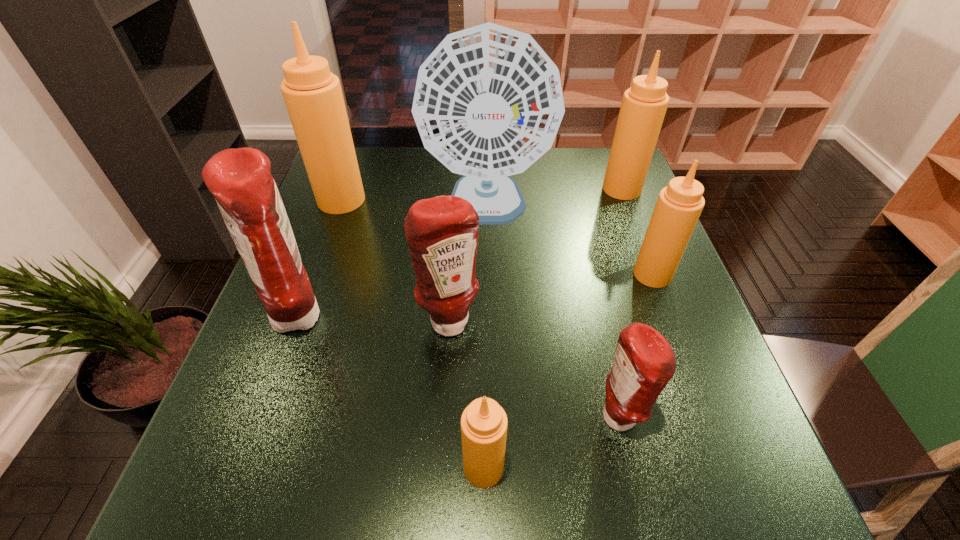
Locate an element on the screen. The width and height of the screenshot is (960, 540). empty location between the second biggest tan condiment and the second red condiment from right to left is located at coordinates (536, 255).

I want to click on vacant area that lies between the second red condiment from right to left and the fourth farthest object, so click(x=551, y=298).

I want to click on unoccupied area between the leftmost tan condiment and the biggest red condiment, so click(321, 258).

Identify the location of free space that is in between the biggest red condiment and the third condiment from right to left. This screenshot has height=540, width=960. (459, 367).

At what (x,y) coordinates should I click in order to perform the action: click on vacant area between the second red condiment from right to left and the leftmost red condiment. Please return your answer as a coordinate pair (x, y). The width and height of the screenshot is (960, 540). Looking at the image, I should click on (374, 319).

Identify the location of free spot between the biggest red condiment and the second nearest condiment. This screenshot has height=540, width=960. (459, 367).

Where is `vacant space that is in between the biggest red condiment and the nearest red condiment`? vacant space that is in between the biggest red condiment and the nearest red condiment is located at coordinates (459, 367).

The image size is (960, 540). In order to click on free area in between the smallest tan condiment and the second biggest red condiment in this screenshot , I will do `click(467, 395)`.

This screenshot has height=540, width=960. What are the coordinates of `object that ranks as the third closest to the fifth nearest condiment` in the screenshot? It's located at (644, 362).

Locate which object ranks third in proximity to the third smallest tan condiment. Please provide its 2D coordinates. Your answer should be formatted as a tuple, i.e. [(x, y)], where the tuple contains the x and y coordinates of a point satisfying the conditions above.

[(442, 232)]